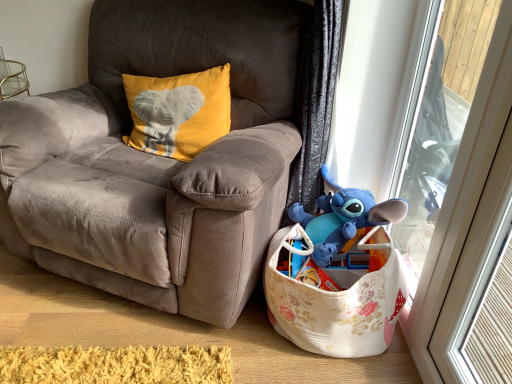
At what (x,y) coordinates should I click in order to perform the action: click on suede gray chair at center. Please return your answer as a coordinate pair (x, y). Image resolution: width=512 pixels, height=384 pixels. Looking at the image, I should click on (158, 159).

Where is `yellow soft fabric pillow with elephant design at upper left`? This screenshot has height=384, width=512. yellow soft fabric pillow with elephant design at upper left is located at coordinates (178, 112).

What do you see at coordinates (338, 299) in the screenshot? This screenshot has height=384, width=512. I see `floral fabric basket at lower right` at bounding box center [338, 299].

Describe the element at coordinates (343, 218) in the screenshot. This screenshot has width=512, height=384. I see `blue plush toy at lower right` at that location.

This screenshot has height=384, width=512. Identify the location of blue plush toy at lower right. (343, 218).

Describe the element at coordinates (462, 206) in the screenshot. Image resolution: width=512 pixels, height=384 pixels. I see `transparent glass door at upper right` at that location.

I want to click on suede gray chair at center, so click(158, 159).

Can you tell me how much floral fabric basket at lower right and transparent glass door at upper right differ in facing direction?

The angular difference between floral fabric basket at lower right and transparent glass door at upper right is 90 degrees.

From the image's perspective, which object appears higher, floral fabric basket at lower right or transparent glass door at upper right?

transparent glass door at upper right appears higher in the image.

Which object is positioned more to the right, floral fabric basket at lower right or transparent glass door at upper right?

Positioned to the right is transparent glass door at upper right.

Is floral fabric basket at lower right far away from transparent glass door at upper right?

floral fabric basket at lower right is actually quite close to transparent glass door at upper right.

Is yellow soft fabric pillow with elephant design at upper left placed right next to floral fabric basket at lower right?

No, yellow soft fabric pillow with elephant design at upper left is not with floral fabric basket at lower right.

Is yellow soft fabric pillow with elephant design at upper left to the left of floral fabric basket at lower right from the viewer's perspective?

Indeed, yellow soft fabric pillow with elephant design at upper left is positioned on the left side of floral fabric basket at lower right.

Is yellow soft fabric pillow with elephant design at upper left closer to the viewer compared to floral fabric basket at lower right?

No.

Which of these two, suede gray chair at center or yellow soft fabric pillow with elephant design at upper left, is wider?

With larger width is suede gray chair at center.

How many degrees apart are the facing directions of suede gray chair at center and yellow soft fabric pillow with elephant design at upper left?

The angular difference between suede gray chair at center and yellow soft fabric pillow with elephant design at upper left is 1.17 degrees.

Is suede gray chair at center facing away from yellow soft fabric pillow with elephant design at upper left?

That's right, suede gray chair at center is facing away from yellow soft fabric pillow with elephant design at upper left.

In the image, is suede gray chair at center positioned in front of or behind yellow soft fabric pillow with elephant design at upper left?

Visually, suede gray chair at center is located in front of yellow soft fabric pillow with elephant design at upper left.

Could you tell me if blue plush toy at lower right is turned towards floral fabric basket at lower right?

Yes, blue plush toy at lower right is facing floral fabric basket at lower right.

Can you confirm if blue plush toy at lower right is wider than floral fabric basket at lower right?

Incorrect, the width of blue plush toy at lower right does not surpass that of floral fabric basket at lower right.

In the scene shown: Is blue plush toy at lower right touching floral fabric basket at lower right?

There is a gap between blue plush toy at lower right and floral fabric basket at lower right.

Is blue plush toy at lower right further to the viewer compared to floral fabric basket at lower right?

Yes, blue plush toy at lower right is further from the viewer.

Is suede gray chair at center bigger or smaller than transparent glass door at upper right?

In the image, suede gray chair at center appears to be larger than transparent glass door at upper right.

In the image, is suede gray chair at center positioned in front of or behind transparent glass door at upper right?

suede gray chair at center is in front of transparent glass door at upper right.

Is suede gray chair at center turned away from transparent glass door at upper right?

suede gray chair at center is not turned away from transparent glass door at upper right.

Does suede gray chair at center have a greater height compared to transparent glass door at upper right?

Incorrect, the height of suede gray chair at center is not larger of that of transparent glass door at upper right.

Is floral fabric basket at lower right thinner than suede gray chair at center?

Yes.

Is point (316, 347) positioned in front of point (108, 194)?

No.

Can suede gray chair at center be found inside floral fabric basket at lower right?

No.

In the scene shown: Is yellow soft fabric pillow with elephant design at upper left not close to suede gray chair at center?

yellow soft fabric pillow with elephant design at upper left is actually quite close to suede gray chair at center.

Can you confirm if yellow soft fabric pillow with elephant design at upper left is bigger than suede gray chair at center?

Actually, yellow soft fabric pillow with elephant design at upper left might be smaller than suede gray chair at center.

In terms of height, does yellow soft fabric pillow with elephant design at upper left look taller or shorter compared to suede gray chair at center?

In the image, yellow soft fabric pillow with elephant design at upper left appears to be shorter than suede gray chair at center.

Is yellow soft fabric pillow with elephant design at upper left facing towards suede gray chair at center?

Yes, yellow soft fabric pillow with elephant design at upper left is facing suede gray chair at center.

This screenshot has width=512, height=384. What are the coordinates of `glass door above the floral fabric basket at lower right (from the image's perspective)` in the screenshot? It's located at (462, 206).

Where is `gift basket that is in front of the yellow soft fabric pillow with elephant design at upper left`? This screenshot has height=384, width=512. gift basket that is in front of the yellow soft fabric pillow with elephant design at upper left is located at coordinates (338, 299).

Considering their positions, is suede gray chair at center positioned closer to blue plush toy at lower right than yellow soft fabric pillow with elephant design at upper left?

suede gray chair at center.

In the scene shown: Looking at the image, which one is located closer to blue plush toy at lower right, yellow soft fabric pillow with elephant design at upper left or suede gray chair at center?

The object closer to blue plush toy at lower right is suede gray chair at center.

Looking at the image, which one is located closer to yellow soft fabric pillow with elephant design at upper left, transparent glass door at upper right or suede gray chair at center?

suede gray chair at center.

Estimate the real-world distances between objects in this image. Which object is further from yellow soft fabric pillow with elephant design at upper left, blue plush toy at lower right or floral fabric basket at lower right?

floral fabric basket at lower right is further to yellow soft fabric pillow with elephant design at upper left.

From the image, which object appears to be farther from blue plush toy at lower right, floral fabric basket at lower right or suede gray chair at center?

Among the two, suede gray chair at center is located further to blue plush toy at lower right.

Based on their spatial positions, is transparent glass door at upper right or blue plush toy at lower right closer to yellow soft fabric pillow with elephant design at upper left?

blue plush toy at lower right is closer to yellow soft fabric pillow with elephant design at upper left.

Estimate the real-world distances between objects in this image. Which object is further from blue plush toy at lower right, yellow soft fabric pillow with elephant design at upper left or transparent glass door at upper right?

Based on the image, yellow soft fabric pillow with elephant design at upper left appears to be further to blue plush toy at lower right.

Estimate the real-world distances between objects in this image. Which object is closer to yellow soft fabric pillow with elephant design at upper left, blue plush toy at lower right or suede gray chair at center?

Based on the image, suede gray chair at center appears to be nearer to yellow soft fabric pillow with elephant design at upper left.

Where is `gift basket situated between suede gray chair at center and transparent glass door at upper right from left to right`? gift basket situated between suede gray chair at center and transparent glass door at upper right from left to right is located at coordinates pyautogui.click(x=338, y=299).

Where is `gift basket between yellow soft fabric pillow with elephant design at upper left and transparent glass door at upper right`? This screenshot has height=384, width=512. gift basket between yellow soft fabric pillow with elephant design at upper left and transparent glass door at upper right is located at coordinates (338, 299).

I want to click on gift basket between suede gray chair at center and blue plush toy at lower right in the horizontal direction, so click(x=338, y=299).

Find the location of a particular element. This screenshot has width=512, height=384. gift basket located between yellow soft fabric pillow with elephant design at upper left and blue plush toy at lower right in the left-right direction is located at coordinates (338, 299).